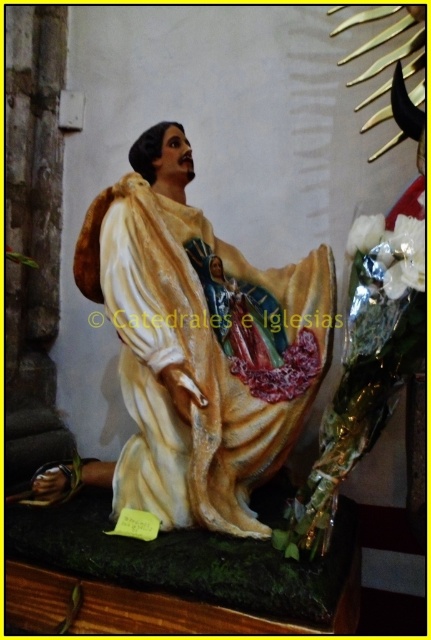
Question: Which point is farther from the camera taking this photo?

Choices:
 (A) (377, 243)
 (B) (128, 348)
 (C) (368, 225)

Answer: (B)

Question: Does white glossy robe at center appear under white metallic flowers at center right?

Choices:
 (A) no
 (B) yes

Answer: (B)

Question: Which point is closer to the camera?

Choices:
 (A) (372, 227)
 (B) (291, 353)

Answer: (A)

Question: Which point is closer to the camera?

Choices:
 (A) white metallic flowers at center right
 (B) white matte flower at center
 (C) white glossy robe at center

Answer: (A)

Question: Does white glossy robe at center have a lesser width compared to white metallic flowers at center right?

Choices:
 (A) yes
 (B) no

Answer: (B)

Question: Observing the image, what is the correct spatial positioning of white glossy robe at center in reference to white matte flower at center?

Choices:
 (A) left
 (B) right

Answer: (A)